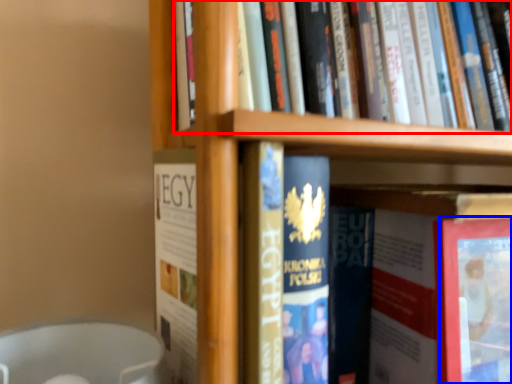
Question: Which object is further to the camera taking this photo, book (highlighted by a red box) or paperback book (highlighted by a blue box)?

Choices:
 (A) book
 (B) paperback book

Answer: (B)